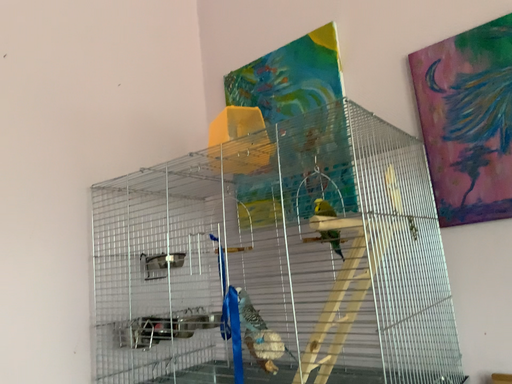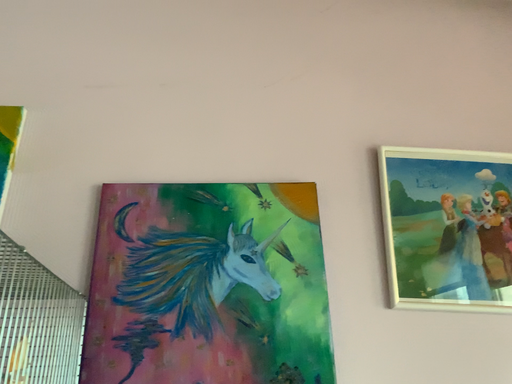
Question: Which way did the camera rotate in the video?

Choices:
 (A) rotated left
 (B) rotated right

Answer: (B)